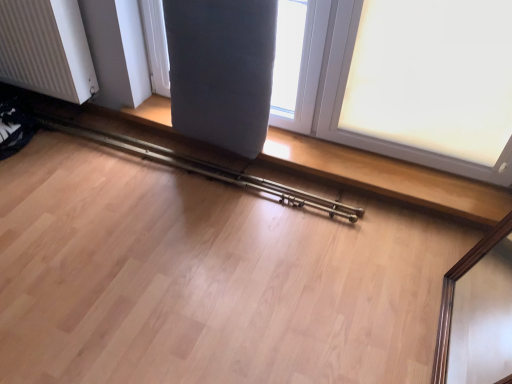
Question: From the image's perspective, is white ribbed radiator at left located above or below matte gray cushion at upper center, the second window positioned from the right?

Choices:
 (A) below
 (B) above

Answer: (B)

Question: In the image, is white ribbed radiator at left positioned in front of or behind matte gray cushion at upper center, which is the 1th window from left to right?

Choices:
 (A) front
 (B) behind

Answer: (B)

Question: Based on their relative distances, which object is nearer to the matte gray cushion at upper center, which is the 1th window from left to right?

Choices:
 (A) metallic brass rail at lower center
 (B) white frosted glass at upper right, positioned as the 2th window in left-to-right order
 (C) white ribbed radiator at left

Answer: (B)

Question: Which of these objects is positioned farthest from the metallic brass rail at lower center?

Choices:
 (A) white frosted glass at upper right, marked as the 1th window in a right-to-left arrangement
 (B) white ribbed radiator at left
 (C) matte gray cushion at upper center, the second window positioned from the right

Answer: (A)